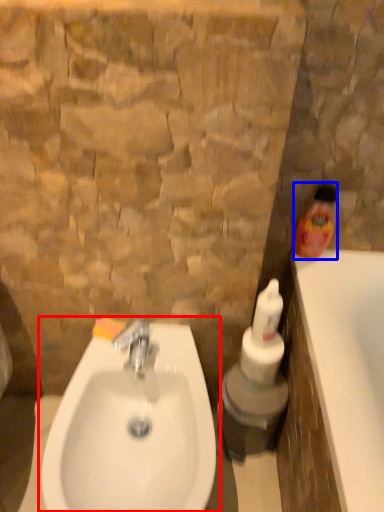
Question: Which point is further to the camera, sink (highlighted by a red box) or cleaning product (highlighted by a blue box)?

Choices:
 (A) sink
 (B) cleaning product

Answer: (B)